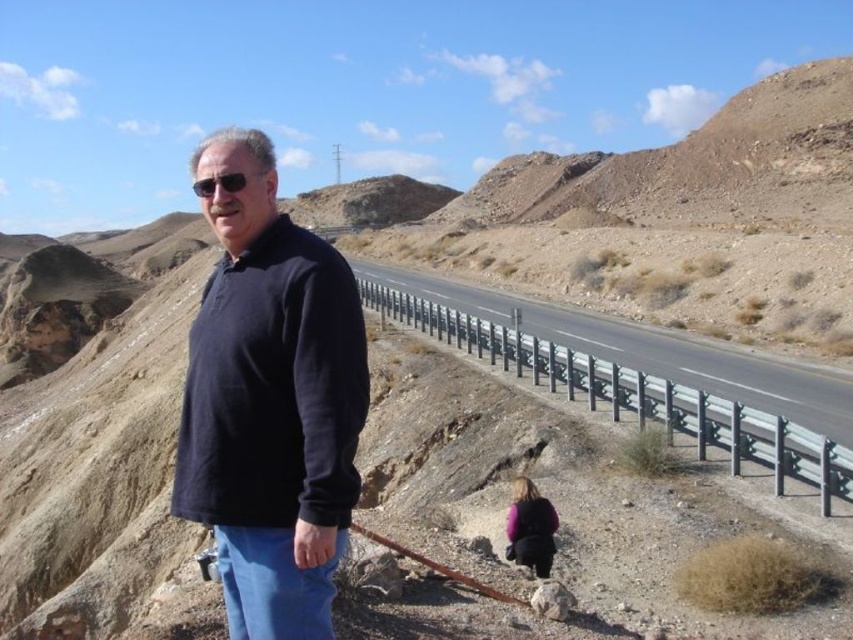
You are a photographer planning to take a wide shot of the desert landscape. You want to ensure the dark blue fleece at center and the metallic gray highway at center are both clearly visible in the frame. Based on their positions, which object will appear closer to the camera in the photo?

The dark blue fleece at center appears closer to the camera because it is positioned in front of the metallic gray highway at center.

You are a photographer planning to capture the dark blue fleece at center and the metallic gray highway at center in a single shot. Based on their sizes in the image, which object would appear more prominent in the photo?

The dark blue fleece at center is larger in size than the metallic gray highway at center, so it would appear more prominent in the photo.